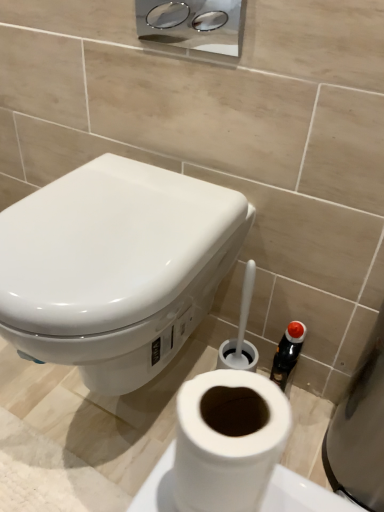
You are a GUI agent. You are given a task and a screenshot of the screen. Output one action in this format:
    pyautogui.click(x=<x>, y=<y>)
    Task: Click on the vacant point above white glossy toilet at upper left (from a real-world perspective)
    
    Given the screenshot: What is the action you would take?
    pyautogui.click(x=107, y=211)